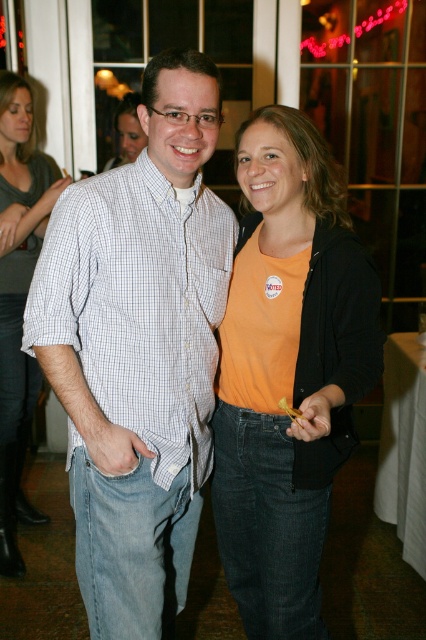
You are standing at the same position as the camera and want to reach both the point at [207,275] and the point at [379,289]. Which point is closer to you?

The point at [379,289] is closer to you because it is in front of the point at [207,275].

You are at a social event and see two people in front of you. The man is wearing a white checkered shirt at center and the woman is wearing an orange matte shirt at center. If you want to hand a drink to the person who is closer to the top of the group, which person should you give it to?

The white checkered shirt at center is located above the orange matte shirt at center, so you should give the drink to the person wearing the white checkered shirt at center since they are higher up.